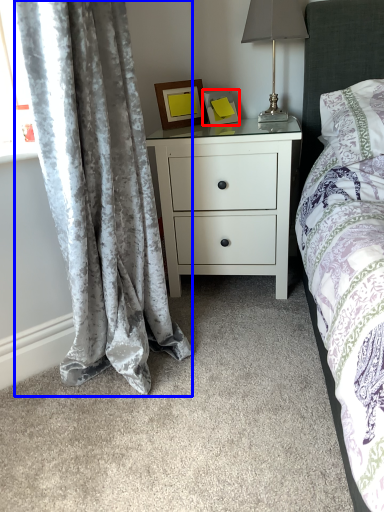
Question: Which of the following is the closest to the observer, picture frame (highlighted by a red box) or curtain (highlighted by a blue box)?

Choices:
 (A) picture frame
 (B) curtain

Answer: (B)